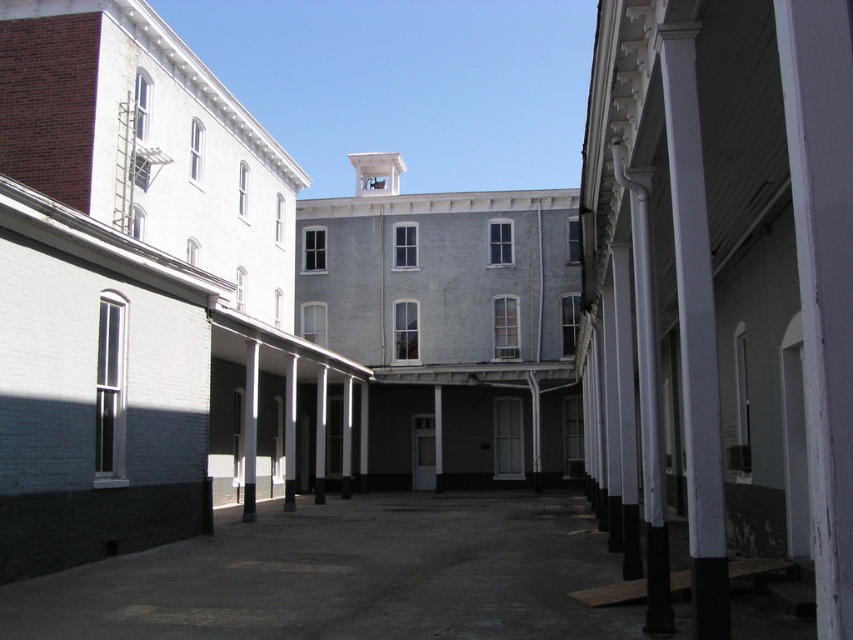
Is dark concrete alley at center positioned in front of white painted wood column at right?

No, dark concrete alley at center is behind white painted wood column at right.

Is dark concrete alley at center smaller than white painted wood column at right?

No, dark concrete alley at center is not smaller than white painted wood column at right.

Locate an element on the screen. This screenshot has width=853, height=640. dark concrete alley at center is located at coordinates (347, 577).

Locate an element on the screen. Image resolution: width=853 pixels, height=640 pixels. dark concrete alley at center is located at coordinates (347, 577).